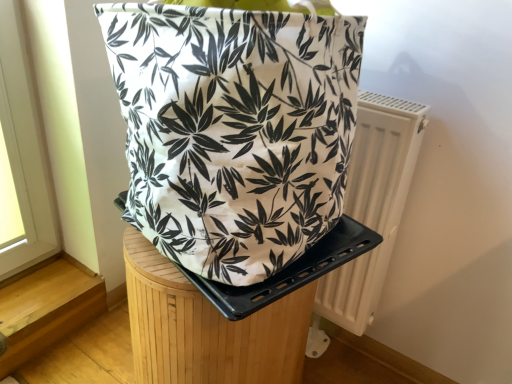
Question: Is point (358, 294) closer or farther from the camera than point (197, 306)?

Choices:
 (A) closer
 (B) farther

Answer: (B)

Question: Relative to wooden stool at center, is white plastic radiator at right in front or behind?

Choices:
 (A) behind
 (B) front

Answer: (A)

Question: Which object is positioned closest to the white canvas bag at center?

Choices:
 (A) white plastic radiator at right
 (B) wooden stool at center

Answer: (B)

Question: Based on their relative distances, which object is nearer to the wooden stool at center?

Choices:
 (A) white plastic radiator at right
 (B) white canvas bag at center

Answer: (B)